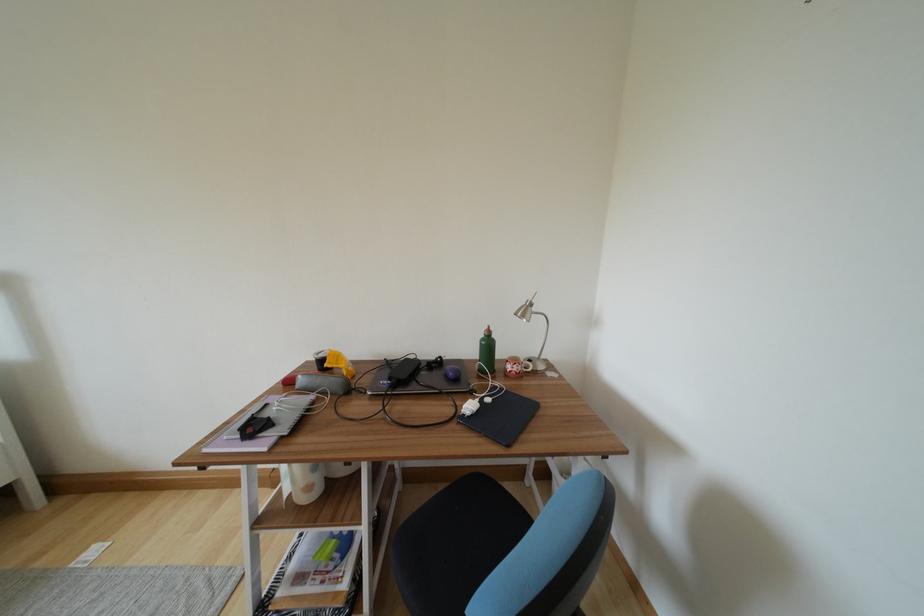
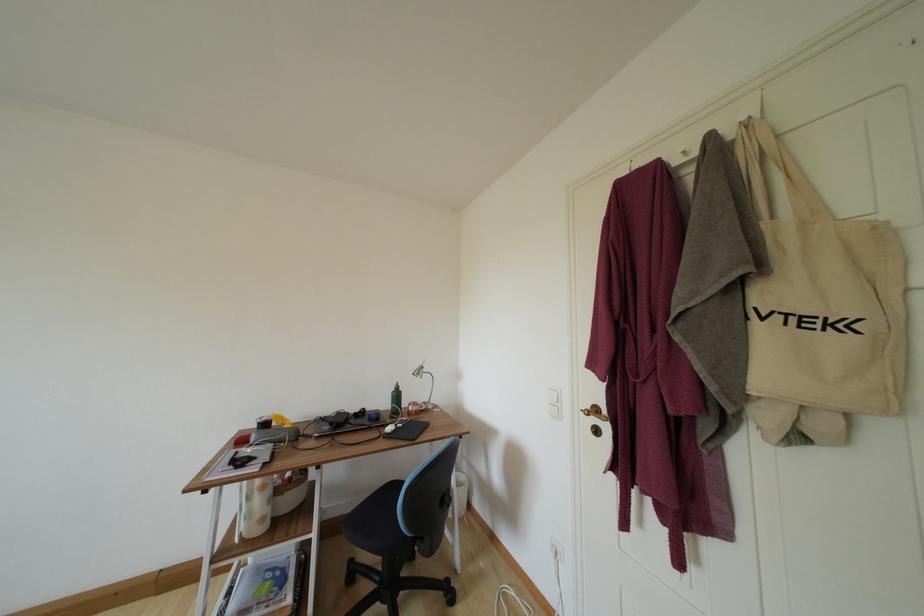
Find the pixel in the second image that matches the point at 487,344 in the first image.

(398, 395)